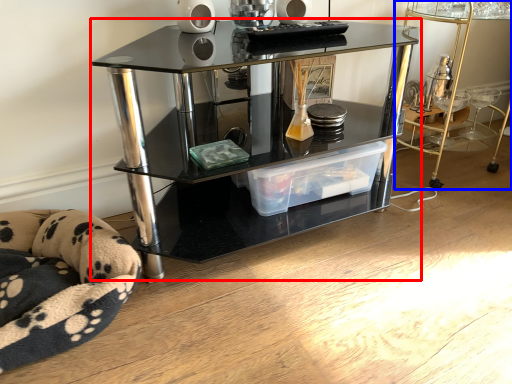
Question: Which object is further to the camera taking this photo, shelf (highlighted by a red box) or table (highlighted by a blue box)?

Choices:
 (A) shelf
 (B) table

Answer: (B)